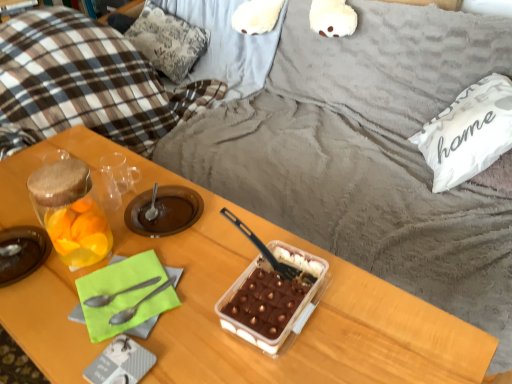
Where is `unoccupied region to the right of translucent glass jar at left, the 2th snack viewed from the right`? Image resolution: width=512 pixels, height=384 pixels. unoccupied region to the right of translucent glass jar at left, the 2th snack viewed from the right is located at coordinates (187, 245).